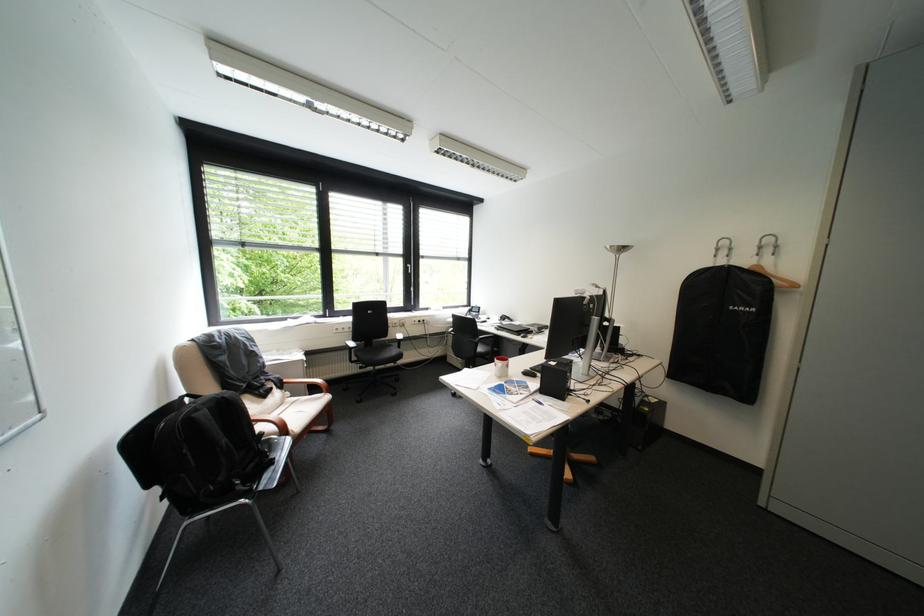
This screenshot has height=616, width=924. I want to click on wooden chair armrest, so pyautogui.click(x=308, y=383).